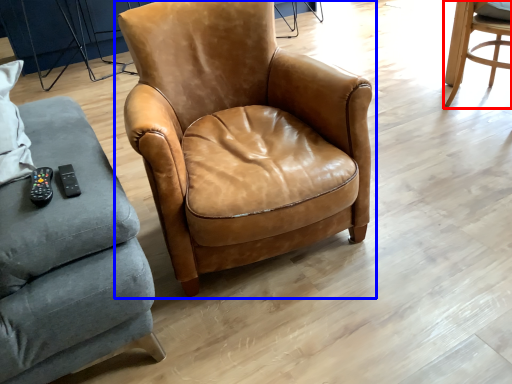
Question: Which object is further to the camera taking this photo, chair (highlighted by a red box) or chair (highlighted by a blue box)?

Choices:
 (A) chair
 (B) chair

Answer: (A)